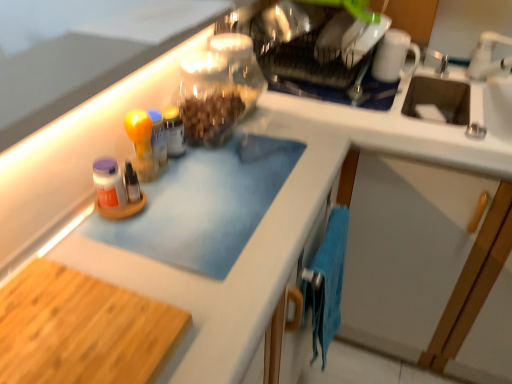
Question: Is white ceramic faucet at upper right further to the viewer compared to clear glass jar at upper center?

Choices:
 (A) yes
 (B) no

Answer: (B)

Question: Is white ceramic faucet at upper right aimed at clear glass jar at upper center?

Choices:
 (A) no
 (B) yes

Answer: (A)

Question: Can you confirm if white ceramic faucet at upper right is bigger than clear glass jar at upper center?

Choices:
 (A) no
 (B) yes

Answer: (A)

Question: Is white ceramic faucet at upper right smaller than clear glass jar at upper center?

Choices:
 (A) yes
 (B) no

Answer: (A)

Question: Can you confirm if white ceramic faucet at upper right is wider than clear glass jar at upper center?

Choices:
 (A) no
 (B) yes

Answer: (A)

Question: From the image's perspective, is white glossy mug at upper right above or below translucent glass jar at center?

Choices:
 (A) above
 (B) below

Answer: (A)

Question: Is white glossy mug at upper right taller or shorter than translucent glass jar at center?

Choices:
 (A) short
 (B) tall

Answer: (B)

Question: Is white glossy mug at upper right spatially inside translucent glass jar at center, or outside of it?

Choices:
 (A) outside
 (B) inside

Answer: (A)

Question: From a real-world perspective, relative to translucent glass jar at center, is white glossy mug at upper right vertically above or below?

Choices:
 (A) above
 (B) below

Answer: (A)

Question: Is white glossy mug at upper right to the left or to the right of clear glass jar at upper center in the image?

Choices:
 (A) right
 (B) left

Answer: (A)

Question: From a real-world perspective, is white glossy mug at upper right physically located above or below clear glass jar at upper center?

Choices:
 (A) above
 (B) below

Answer: (A)

Question: From the image's perspective, is white glossy mug at upper right positioned above or below clear glass jar at upper center?

Choices:
 (A) below
 (B) above

Answer: (B)

Question: In terms of height, does white glossy mug at upper right look taller or shorter compared to clear glass jar at upper center?

Choices:
 (A) short
 (B) tall

Answer: (B)

Question: Considering the positions of point (136, 43) and point (510, 39), is point (136, 43) closer or farther from the camera than point (510, 39)?

Choices:
 (A) closer
 (B) farther

Answer: (A)

Question: Considering the positions of blue matte cutting board at upper left and white ceramic faucet at upper right in the image, is blue matte cutting board at upper left taller or shorter than white ceramic faucet at upper right?

Choices:
 (A) tall
 (B) short

Answer: (B)